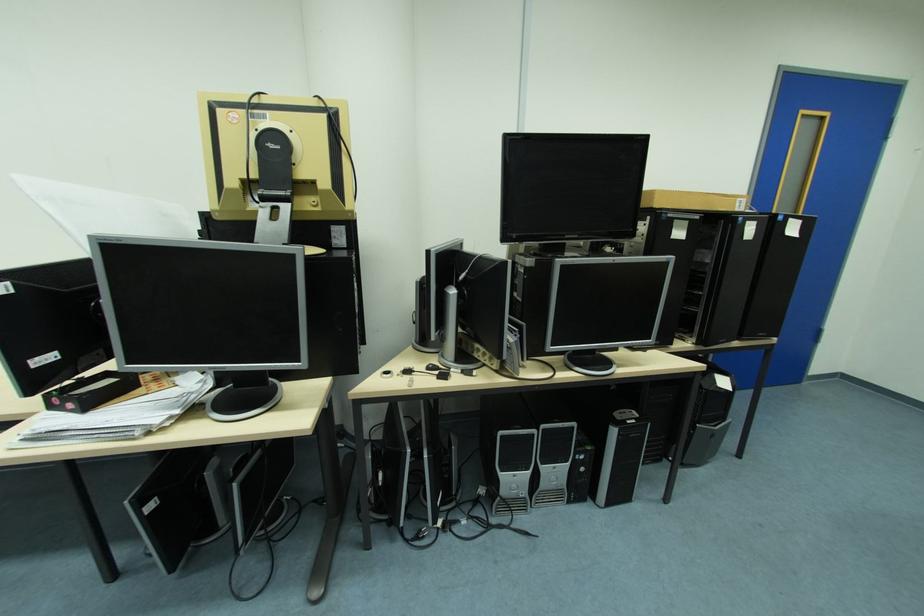
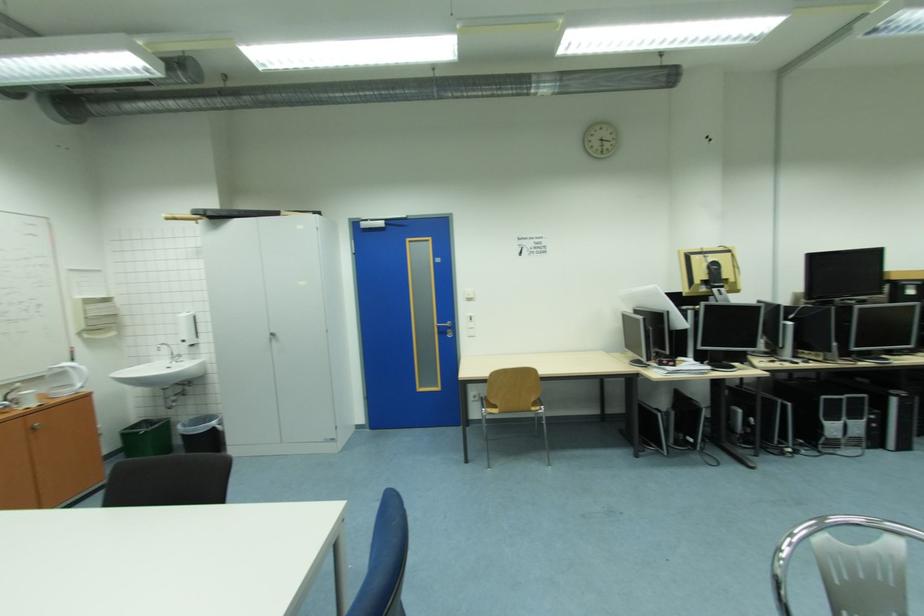
In the second image, find the point that corresponds to point (621, 432) in the first image.

(901, 400)